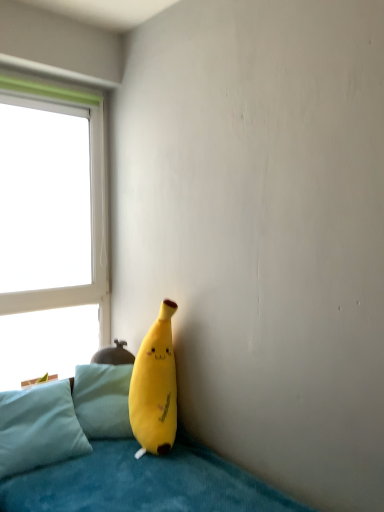
Question: Is yellow plush toy at lower center surrounding white plastic window at upper left?

Choices:
 (A) no
 (B) yes

Answer: (A)

Question: Does yellow plush toy at lower center come in front of white plastic window at upper left?

Choices:
 (A) no
 (B) yes

Answer: (B)

Question: Does yellow plush toy at lower center lie behind white plastic window at upper left?

Choices:
 (A) no
 (B) yes

Answer: (A)

Question: From a real-world perspective, is yellow plush toy at lower center under white plastic window at upper left?

Choices:
 (A) yes
 (B) no

Answer: (A)

Question: Can you confirm if yellow plush toy at lower center is shorter than white plastic window at upper left?

Choices:
 (A) no
 (B) yes

Answer: (B)

Question: Looking at their shapes, would you say light blue plush pillow at lower left is wider or thinner than white plastic window at upper left?

Choices:
 (A) thin
 (B) wide

Answer: (B)

Question: Is light blue plush pillow at lower left spatially inside white plastic window at upper left, or outside of it?

Choices:
 (A) inside
 (B) outside

Answer: (B)

Question: In the image, is light blue plush pillow at lower left positioned in front of or behind white plastic window at upper left?

Choices:
 (A) front
 (B) behind

Answer: (A)

Question: From a real-world perspective, is light blue plush pillow at lower left above or below white plastic window at upper left?

Choices:
 (A) below
 (B) above

Answer: (A)

Question: Based on their positions, is white plastic window at upper left located to the left or right of soft blue fabric couch at lower left?

Choices:
 (A) left
 (B) right

Answer: (A)

Question: Is white plastic window at upper left situated inside soft blue fabric couch at lower left or outside?

Choices:
 (A) inside
 (B) outside

Answer: (B)

Question: From the image's perspective, is white plastic window at upper left positioned above or below soft blue fabric couch at lower left?

Choices:
 (A) above
 (B) below

Answer: (A)

Question: Considering the positions of point (79, 157) and point (193, 446), is point (79, 157) closer or farther from the camera than point (193, 446)?

Choices:
 (A) farther
 (B) closer

Answer: (A)

Question: Considering the positions of light blue plush pillow at lower left and soft blue fabric couch at lower left in the image, is light blue plush pillow at lower left taller or shorter than soft blue fabric couch at lower left?

Choices:
 (A) short
 (B) tall

Answer: (A)

Question: From a real-world perspective, is light blue plush pillow at lower left physically located above or below soft blue fabric couch at lower left?

Choices:
 (A) above
 (B) below

Answer: (A)